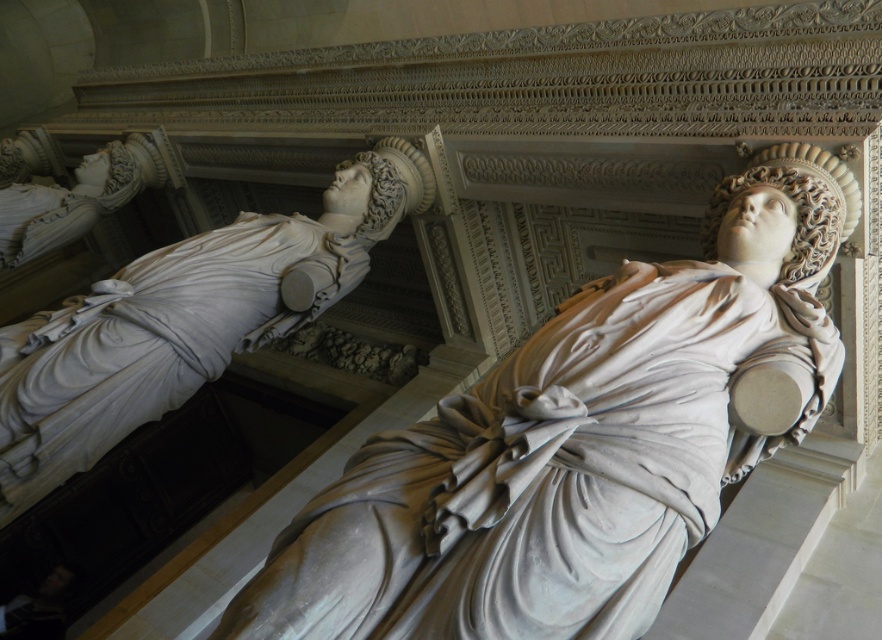
Which of these two, white marble statue at center or white marble statue at upper left, stands taller?

With more height is white marble statue at upper left.

Who is higher up, white marble statue at center or white marble statue at upper left?

white marble statue at upper left

Which is in front, point (468, 522) or point (252, 216)?

Positioned in front is point (468, 522).

Where is `white marble statue at center`? white marble statue at center is located at coordinates (581, 442).